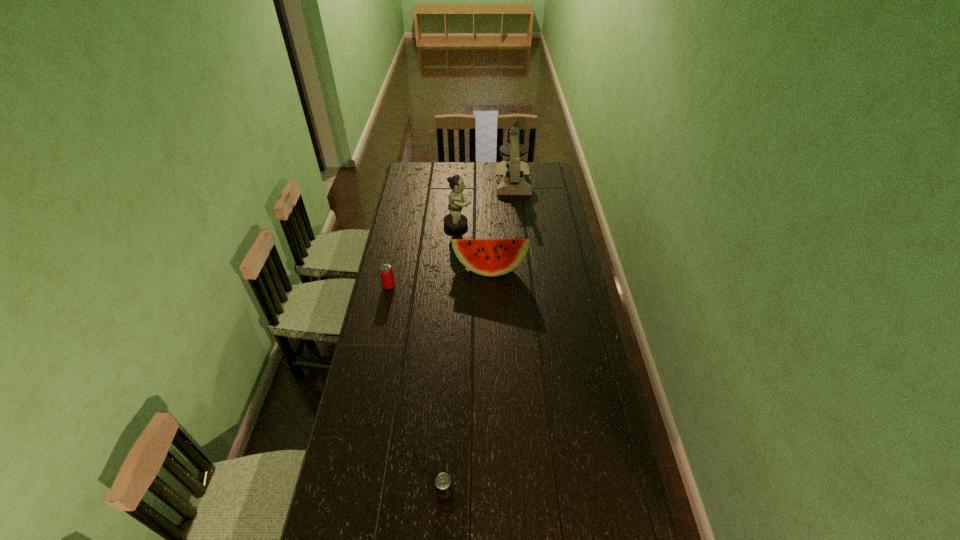
Identify the location of microscope. (512, 177).

You are a GUI agent. You are given a task and a screenshot of the screen. Output one action in this format:
    pyautogui.click(x=<x>, y=<y>)
    Task: Click on the farthest object
    This screenshot has width=960, height=540.
    Given the screenshot: What is the action you would take?
    pyautogui.click(x=512, y=177)

Locate an element on the screen. The width and height of the screenshot is (960, 540). the fourth nearest object is located at coordinates (455, 221).

This screenshot has width=960, height=540. Identify the location of the second tallest object. (455, 221).

The image size is (960, 540). Find the location of `the third shortest object`. the third shortest object is located at coordinates (489, 257).

Find the location of `watermelon`. watermelon is located at coordinates (489, 257).

Find the location of `the nearer beer can`. the nearer beer can is located at coordinates coord(443,483).

Where is `the right beer can`? This screenshot has width=960, height=540. the right beer can is located at coordinates (443, 483).

Find the location of a particular element. The image size is (960, 540). the second nearest object is located at coordinates (387, 277).

Find the location of a particular element. the leftmost object is located at coordinates (387, 277).